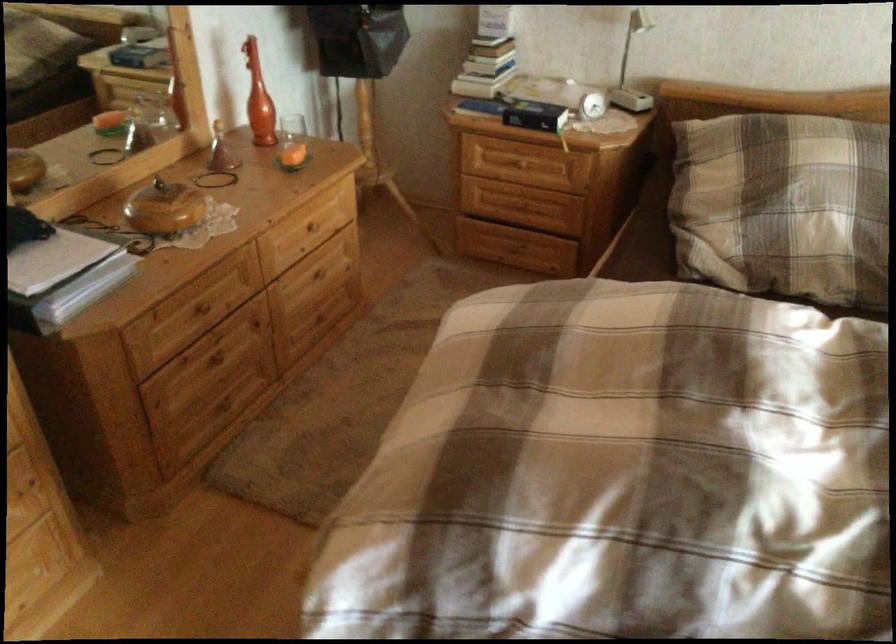
In order to click on plaid pillow in this screenshot , I will do `click(782, 205)`.